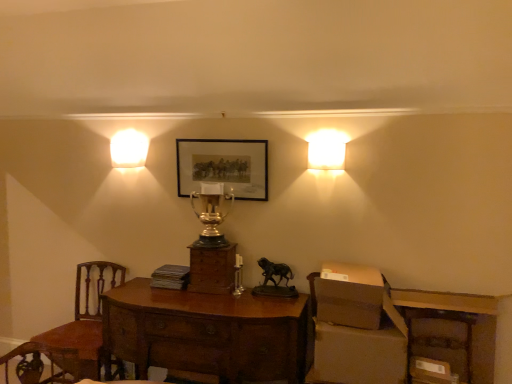
Question: Is brown cardboard box at lower right, placed as the 2th cardboard box when sorted from bottom to top, turned away from matte black picture frame at center?

Choices:
 (A) yes
 (B) no

Answer: (B)

Question: From the image's perspective, is brown cardboard box at lower right, which is the second cardboard box in top-to-bottom order, below matte black picture frame at center?

Choices:
 (A) no
 (B) yes

Answer: (B)

Question: From a real-world perspective, does brown cardboard box at lower right, which is the second cardboard box in top-to-bottom order, stand above matte black picture frame at center?

Choices:
 (A) no
 (B) yes

Answer: (A)

Question: From the image's perspective, is brown cardboard box at lower right, which is the second cardboard box in top-to-bottom order, over matte black picture frame at center?

Choices:
 (A) yes
 (B) no

Answer: (B)

Question: Is brown cardboard box at lower right, placed as the 2th cardboard box when sorted from bottom to top, not close to matte black picture frame at center?

Choices:
 (A) no
 (B) yes

Answer: (B)

Question: Does brown cardboard box at lower right, which is the second cardboard box in top-to-bottom order, have a lesser height compared to matte black picture frame at center?

Choices:
 (A) no
 (B) yes

Answer: (B)

Question: Considering the relative positions of matte white square at upper right, marked as the 1th lamp in a right-to-left arrangement, and brown cardboard box at right, the 1th cardboard box when ordered from top to bottom, in the image provided, is matte white square at upper right, marked as the 1th lamp in a right-to-left arrangement, to the right of brown cardboard box at right, the 1th cardboard box when ordered from top to bottom, from the viewer's perspective?

Choices:
 (A) yes
 (B) no

Answer: (B)

Question: Does matte white square at upper right, the second lamp viewed from the left, have a smaller size compared to brown cardboard box at right, which is counted as the third cardboard box, starting from the bottom?

Choices:
 (A) yes
 (B) no

Answer: (A)

Question: Can you confirm if matte white square at upper right, marked as the 1th lamp in a right-to-left arrangement, is thinner than brown cardboard box at right, the 1th cardboard box when ordered from top to bottom?

Choices:
 (A) yes
 (B) no

Answer: (A)

Question: Would you consider matte white square at upper right, the second lamp viewed from the left, to be distant from brown cardboard box at right, which is counted as the third cardboard box, starting from the bottom?

Choices:
 (A) yes
 (B) no

Answer: (B)

Question: From the image's perspective, is matte white square at upper right, marked as the 1th lamp in a right-to-left arrangement, below brown cardboard box at right, which is counted as the third cardboard box, starting from the bottom?

Choices:
 (A) no
 (B) yes

Answer: (A)

Question: Is matte white square at upper right, marked as the 1th lamp in a right-to-left arrangement, beside brown cardboard box at right, which is counted as the third cardboard box, starting from the bottom?

Choices:
 (A) yes
 (B) no

Answer: (B)

Question: From the image's perspective, is brown cardboard box at right, which is counted as the third cardboard box, starting from the bottom, located beneath matte gold trophy at upper center, placed as the 2th lamp when sorted from front to back?

Choices:
 (A) no
 (B) yes

Answer: (B)